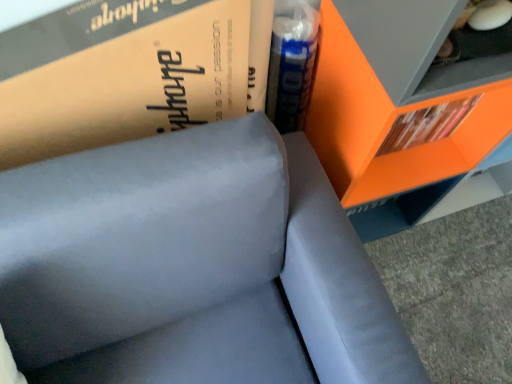
This screenshot has height=384, width=512. What do you see at coordinates (291, 62) in the screenshot?
I see `translucent plastic bottle at upper right` at bounding box center [291, 62].

In order to face translucent plastic bottle at upper right, should I rotate leftwards or rightwards?

You should rotate right by 4.493 degrees.

Find the location of a particular element. translucent plastic bottle at upper right is located at coordinates (291, 62).

This screenshot has height=384, width=512. Identify the location of translucent plastic bottle at upper right. [291, 62].